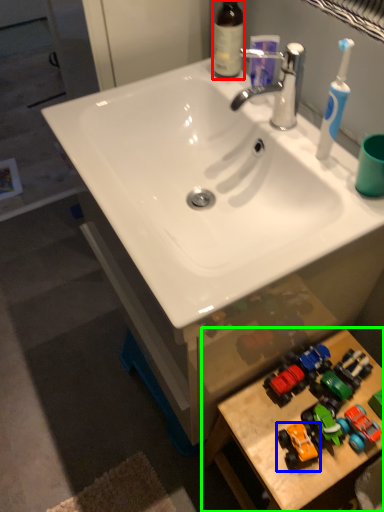
Question: Estimate the real-world distances between objects in this image. Which object is closer to bottle (highlighted by a red box), toy (highlighted by a blue box) or table (highlighted by a green box)?

Choices:
 (A) toy
 (B) table

Answer: (B)